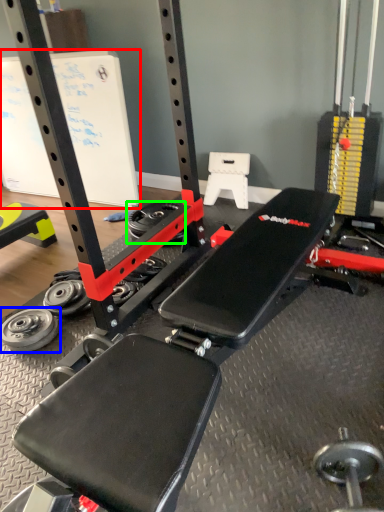
Question: Which object is positioned farthest from bulletin board (highlighted by a red box)? Select from wheel (highlighted by a blue box) and wheel (highlighted by a green box).

Choices:
 (A) wheel
 (B) wheel

Answer: (A)